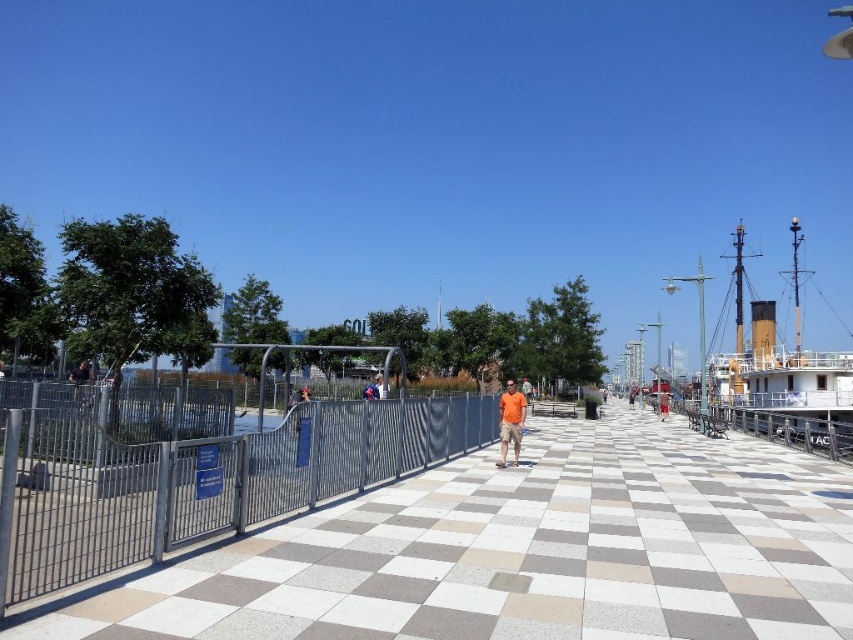
Is white checkered pavement at center wider than white wooden ship at right?

No, white checkered pavement at center is not wider than white wooden ship at right.

This screenshot has height=640, width=853. I want to click on white checkered pavement at center, so click(x=527, y=552).

Does point (848, 380) lie behind point (73, 401)?

Yes, it is.

Based on the photo, measure the distance between point (740, 344) and camera.

208.05 feet

Does point (764, 376) come farther from viewer compared to point (90, 380)?

Yes, point (764, 376) is farther from viewer.

Image resolution: width=853 pixels, height=640 pixels. Find the location of `white wooden ship at right`. white wooden ship at right is located at coordinates (780, 388).

Can you confirm if white checkered pavement at center is wider than matte black shirt at left?

Correct, the width of white checkered pavement at center exceeds that of matte black shirt at left.

Can you confirm if white checkered pavement at center is positioned above matte black shirt at left?

No, white checkered pavement at center is not above matte black shirt at left.

Describe the element at coordinates (527, 552) in the screenshot. I see `white checkered pavement at center` at that location.

You are a GUI agent. You are given a task and a screenshot of the screen. Output one action in this format:
    pyautogui.click(x=<x>, y=<y>)
    Task: Click on the white checkered pavement at center
    The height and width of the screenshot is (640, 853).
    Given the screenshot: What is the action you would take?
    pyautogui.click(x=527, y=552)